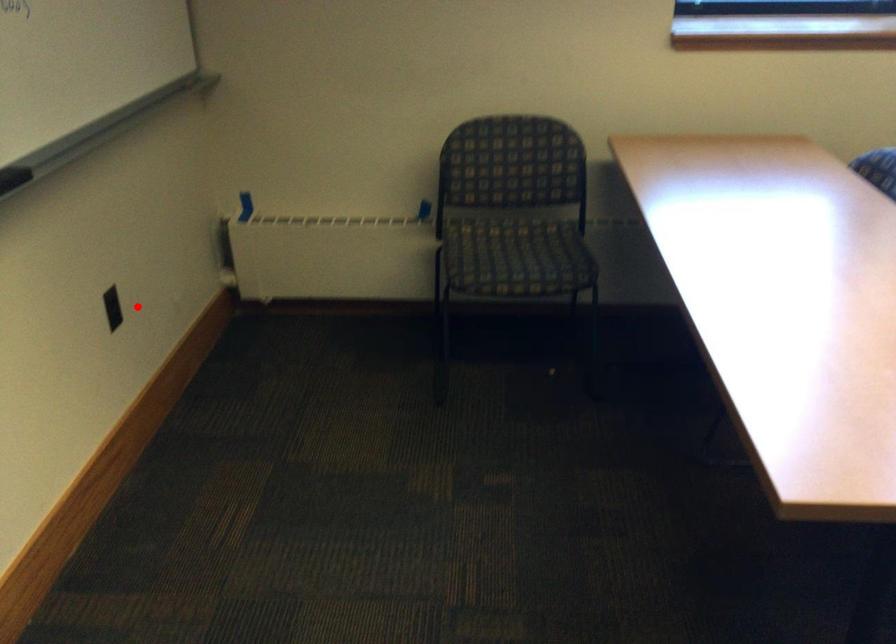
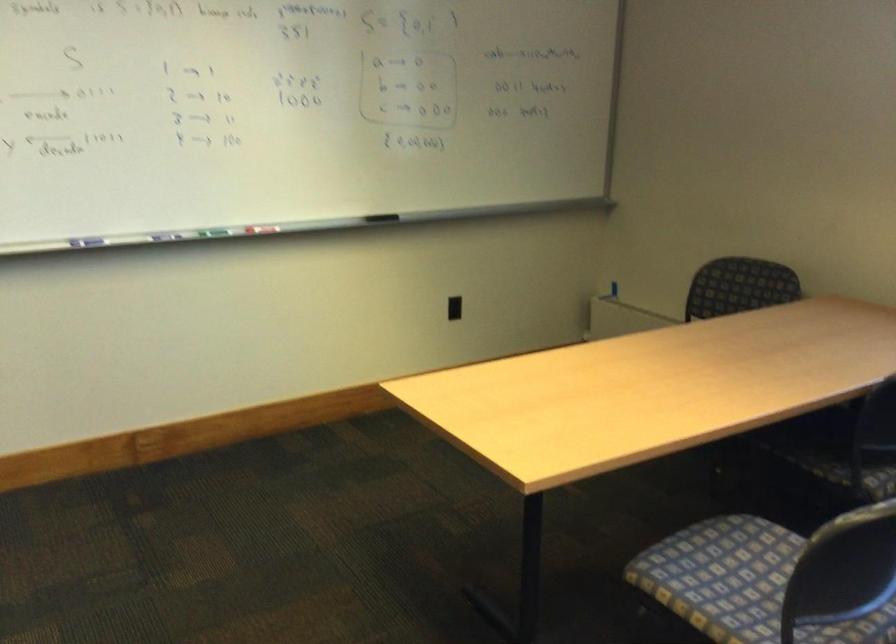
The point at the highlighted location is marked in the first image. Where is the corresponding point in the second image?

(453, 308)